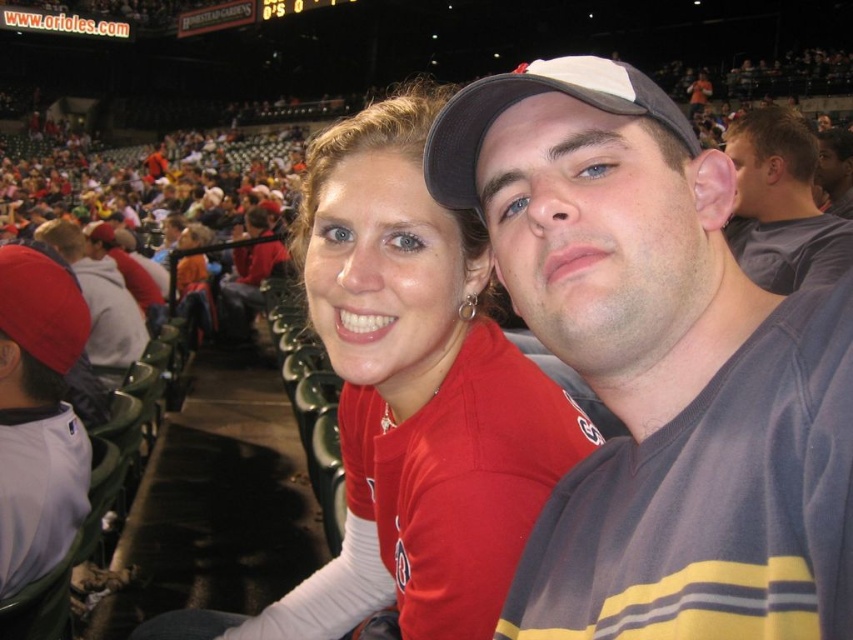
Question: Which point appears closest to the camera in this image?

Choices:
 (A) (827, 148)
 (B) (792, 131)
 (C) (403, 586)

Answer: (C)

Question: Can you confirm if gray/yellow striped t-shirt at center is bigger than gray cotton t-shirt at upper right?

Choices:
 (A) no
 (B) yes

Answer: (A)

Question: Which of the following is the closest to the observer?

Choices:
 (A) matte gray shirt at upper right
 (B) gray cotton t-shirt at upper right

Answer: (B)

Question: Which point is closer to the camera taking this photo?

Choices:
 (A) (824, 241)
 (B) (381, 250)
 (C) (35, 490)

Answer: (C)

Question: Does matte red jersey at center appear on the left side of white jersey at left?

Choices:
 (A) no
 (B) yes

Answer: (A)

Question: Can you confirm if white jersey at left is positioned above gray cotton t-shirt at upper right?

Choices:
 (A) no
 (B) yes

Answer: (A)